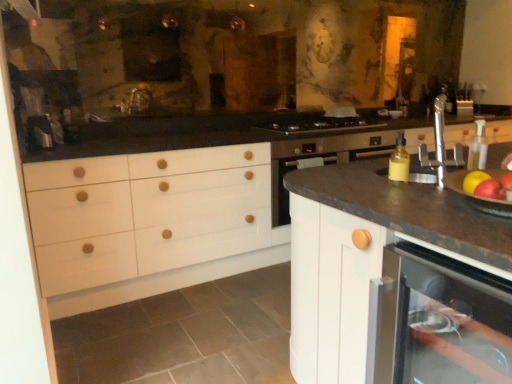
Find the location of a particular element. The width and height of the screenshot is (512, 384). free space to the left of shiny red apple at right, which ranks as the second apple in front-to-back order is located at coordinates (412, 205).